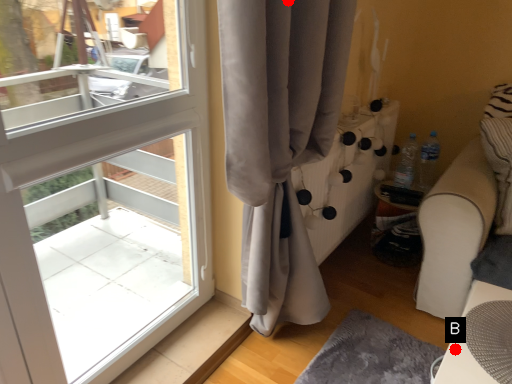
Question: Two points are circled on the image, labeled by A and B beside each circle. Which point appears closest to the camera in this image?

Choices:
 (A) A is closer
 (B) B is closer

Answer: (A)